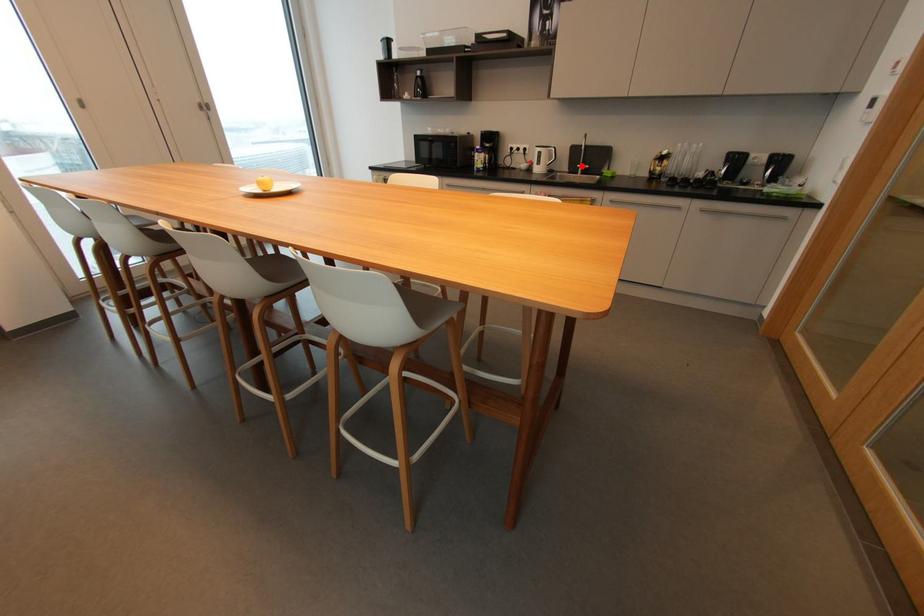
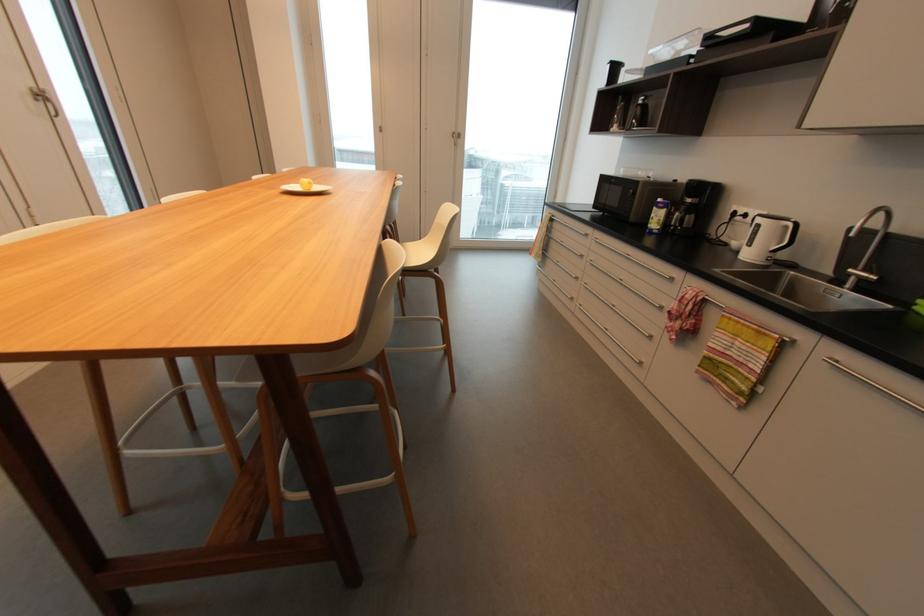
In the second image, find the point that corresponds to the highlighted location in the first image.

(854, 270)